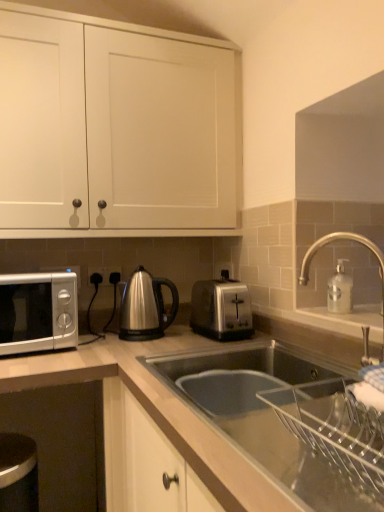
Question: Is stainless steel kettle at center in front of or behind satin silver toaster at center in the image?

Choices:
 (A) front
 (B) behind

Answer: (B)

Question: From their relative heights in the image, would you say stainless steel kettle at center is taller or shorter than satin silver toaster at center?

Choices:
 (A) tall
 (B) short

Answer: (B)

Question: Based on their relative distances, which object is farther from the satin silver toaster at center?

Choices:
 (A) satin silver outlet at center, placed as the second electric outlet when sorted from right to left
 (B) satin silver toaster at center
 (C) white matte cabinet doors at upper center
 (D) white matte microwave oven at left
 (E) satin silver outlet at center, which is the second electric outlet in left-to-right order

Answer: (A)

Question: Estimate the real-world distances between objects in this image. Which object is farther from the satin silver outlet at center, which is the 1th electric outlet in right-to-left order?

Choices:
 (A) satin silver toaster at center
 (B) white matte microwave oven at left
 (C) white matte cabinet doors at upper center
 (D) satin silver toaster at center
 (E) stainless steel kettle at center

Answer: (D)